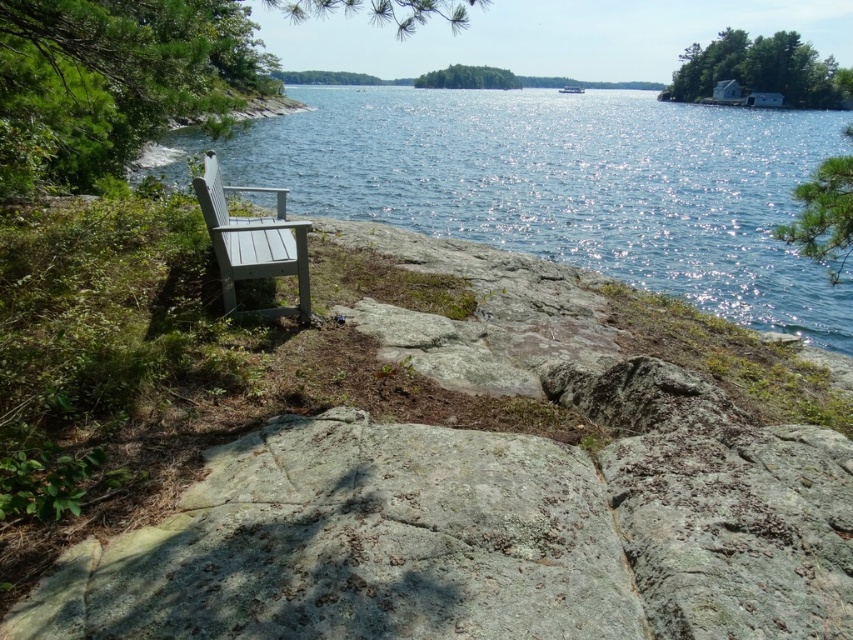
Question: Does glistening blue water at center have a lesser width compared to gray wood chair at center?

Choices:
 (A) no
 (B) yes

Answer: (A)

Question: Does glistening blue water at center have a greater width compared to gray wood chair at center?

Choices:
 (A) no
 (B) yes

Answer: (B)

Question: Which point is farther to the camera?

Choices:
 (A) glistening blue water at center
 (B) gray wood chair at center

Answer: (A)

Question: Does glistening blue water at center appear on the left side of gray wood chair at center?

Choices:
 (A) no
 (B) yes

Answer: (A)